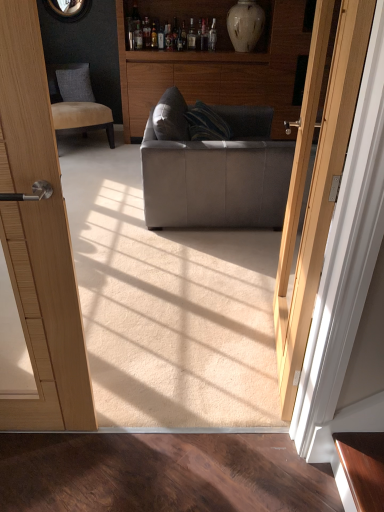
Describe the element at coordinates (245, 25) in the screenshot. I see `white glossy vase at upper center` at that location.

Image resolution: width=384 pixels, height=512 pixels. What do you see at coordinates (77, 102) in the screenshot?
I see `beige fabric chair at upper left` at bounding box center [77, 102].

Where is `beige fabric chair at upper left`? The width and height of the screenshot is (384, 512). beige fabric chair at upper left is located at coordinates (77, 102).

Find the location of a particular element. The image size is (384, 512). wooden cabinet at center is located at coordinates (215, 62).

Measure the distance between point (282,118) and camera.

They are 15.16 feet apart.

Locate an element on the screen. This screenshot has height=512, width=384. matte gray fabric couch at center is located at coordinates (218, 175).

Do you think dark gray fabric pillow at upper left is within white glossy vase at upper center, or outside of it?

dark gray fabric pillow at upper left exists outside the volume of white glossy vase at upper center.

Which is farther, (x=71, y=70) or (x=237, y=26)?

The point (x=71, y=70) is behind.

Is dark gray fabric pillow at upper left next to white glossy vase at upper center?

There is a gap between dark gray fabric pillow at upper left and white glossy vase at upper center.

From the image's perspective, is beige fabric chair at upper left located beneath white glossy vase at upper center?

Correct, beige fabric chair at upper left appears lower than white glossy vase at upper center in the image.

Is beige fabric chair at upper left positioned behind white glossy vase at upper center?

No, the depth of beige fabric chair at upper left is less than that of white glossy vase at upper center.

Does point (113, 145) appear closer or farther from the camera than point (244, 2)?

Point (113, 145).

Can you confirm if wooden cabinet at center is shorter than dark gray fabric pillow at upper left?

In fact, wooden cabinet at center may be taller than dark gray fabric pillow at upper left.

Considering the relative positions of wooden cabinet at center and dark gray fabric pillow at upper left in the image provided, is wooden cabinet at center to the right of dark gray fabric pillow at upper left from the viewer's perspective?

Indeed, wooden cabinet at center is positioned on the right side of dark gray fabric pillow at upper left.

Is wooden cabinet at center positioned behind dark gray fabric pillow at upper left?

No, wooden cabinet at center is closer to the camera.

Where is `cabinetry that appears on the right of dark gray fabric pillow at upper left`? cabinetry that appears on the right of dark gray fabric pillow at upper left is located at coordinates (215, 62).

Is wooden cabinet at center a part of dark gray fabric pillow at upper left?

That's incorrect, wooden cabinet at center is not inside dark gray fabric pillow at upper left.

Considering the relative sizes of dark gray fabric pillow at upper left and wooden cabinet at center in the image provided, is dark gray fabric pillow at upper left shorter than wooden cabinet at center?

Yes, dark gray fabric pillow at upper left is shorter than wooden cabinet at center.

Can you tell me how much dark gray fabric pillow at upper left and wooden cabinet at center differ in facing direction?

The angle between the facing direction of dark gray fabric pillow at upper left and the facing direction of wooden cabinet at center is 9.45 degrees.

Identify the location of studio couch on the right side of beige fabric chair at upper left. This screenshot has height=512, width=384. (218, 175).

Looking at this image, is beige fabric chair at upper left looking in the opposite direction of matte gray fabric couch at center?

beige fabric chair at upper left does not have its back to matte gray fabric couch at center.

Which object is positioned more to the right, beige fabric chair at upper left or matte gray fabric couch at center?

matte gray fabric couch at center.

From the image's perspective, relative to matte gray fabric couch at center, is beige fabric chair at upper left above or below?

Based on their image positions, beige fabric chair at upper left is located above matte gray fabric couch at center.

Where is `pillow above the beige fabric chair at upper left (from the image's perspective)`? The height and width of the screenshot is (512, 384). pillow above the beige fabric chair at upper left (from the image's perspective) is located at coordinates (75, 83).

Considering the positions of objects dark gray fabric pillow at upper left and beige fabric chair at upper left in the image provided, who is more to the left, dark gray fabric pillow at upper left or beige fabric chair at upper left?

beige fabric chair at upper left is more to the left.

Between dark gray fabric pillow at upper left and beige fabric chair at upper left, which one has smaller size?

Smaller between the two is dark gray fabric pillow at upper left.

Could you tell me if dark gray fabric pillow at upper left is facing beige fabric chair at upper left?

Yes, dark gray fabric pillow at upper left is turned towards beige fabric chair at upper left.

Is wooden cabinet at center not inside white glossy vase at upper center?

Absolutely, wooden cabinet at center is external to white glossy vase at upper center.

Considering the sizes of wooden cabinet at center and white glossy vase at upper center in the image, is wooden cabinet at center taller or shorter than white glossy vase at upper center?

Considering their sizes, wooden cabinet at center has more height than white glossy vase at upper center.

How far apart are wooden cabinet at center and white glossy vase at upper center?

wooden cabinet at center is 17.40 inches from white glossy vase at upper center.

Are wooden cabinet at center and white glossy vase at upper center far apart?

They are positioned close to each other.

Locate an element on the screen. This screenshot has height=512, width=384. vase positioned vertically above the dark gray fabric pillow at upper left (from a real-world perspective) is located at coordinates (245, 25).

Identify the location of vase behind the beige fabric chair at upper left. This screenshot has width=384, height=512. coord(245,25).

Considering their positions, is matte gray fabric couch at center positioned closer to beige fabric chair at upper left than wooden cabinet at center?

wooden cabinet at center is closer to beige fabric chair at upper left.

Based on their spatial positions, is white glossy vase at upper center or beige fabric chair at upper left closer to matte gray fabric couch at center?

Based on the image, beige fabric chair at upper left appears to be nearer to matte gray fabric couch at center.

Looking at the image, which one is located closer to wooden cabinet at center, matte gray fabric couch at center or beige fabric chair at upper left?

Based on the image, beige fabric chair at upper left appears to be nearer to wooden cabinet at center.

From the image, which object appears to be nearer to wooden cabinet at center, beige fabric chair at upper left or dark gray fabric pillow at upper left?

beige fabric chair at upper left lies closer to wooden cabinet at center than the other object.

Considering their positions, is dark gray fabric pillow at upper left positioned closer to white glossy vase at upper center than matte gray fabric couch at center?

Based on the image, dark gray fabric pillow at upper left appears to be nearer to white glossy vase at upper center.

Looking at the image, which one is located closer to matte gray fabric couch at center, beige fabric chair at upper left or dark gray fabric pillow at upper left?

beige fabric chair at upper left.

Looking at the image, which one is located closer to beige fabric chair at upper left, matte gray fabric couch at center or white glossy vase at upper center?

Among the two, white glossy vase at upper center is located nearer to beige fabric chair at upper left.

Considering their positions, is white glossy vase at upper center positioned further to beige fabric chair at upper left than dark gray fabric pillow at upper left?

white glossy vase at upper center.

The width and height of the screenshot is (384, 512). Identify the location of studio couch situated between beige fabric chair at upper left and white glossy vase at upper center from left to right. (218, 175).

This screenshot has height=512, width=384. I want to click on vase located between matte gray fabric couch at center and dark gray fabric pillow at upper left in the depth direction, so (x=245, y=25).

At what (x,y) coordinates should I click in order to perform the action: click on pillow situated between beige fabric chair at upper left and white glossy vase at upper center from left to right. Please return your answer as a coordinate pair (x, y). The height and width of the screenshot is (512, 384). Looking at the image, I should click on (75, 83).

Identify the location of pillow between beige fabric chair at upper left and wooden cabinet at center. (75, 83).